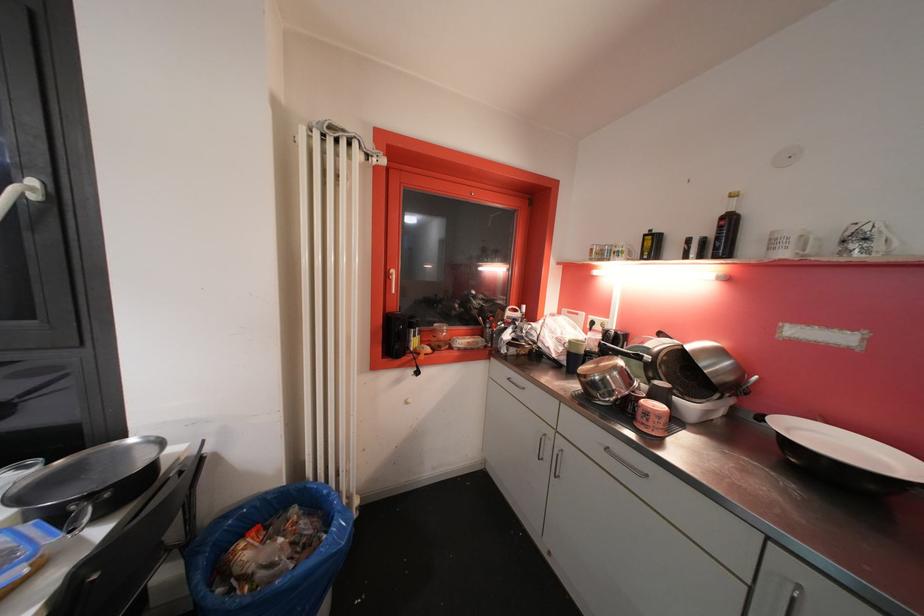
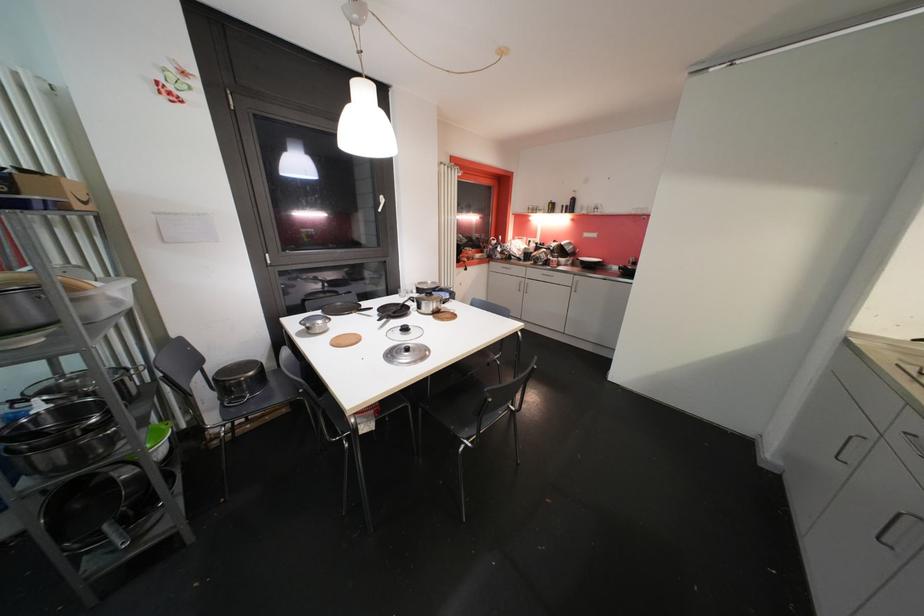
In a continuous first-person perspective shot, in which direction is the camera moving?

The cameraman walked toward left, backward.